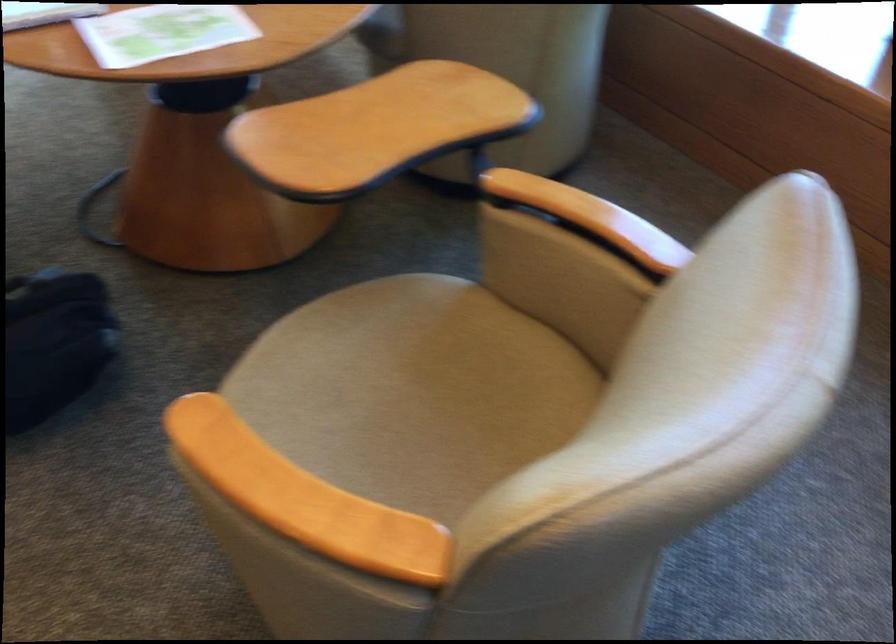
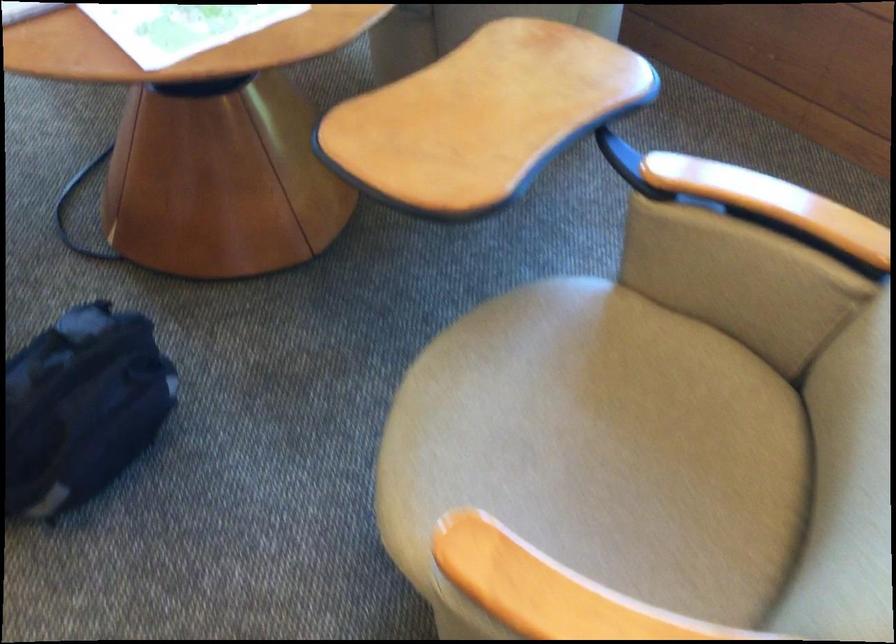
Where in the second image is the point corresponding to the point at 367,125 from the first image?

(483, 116)